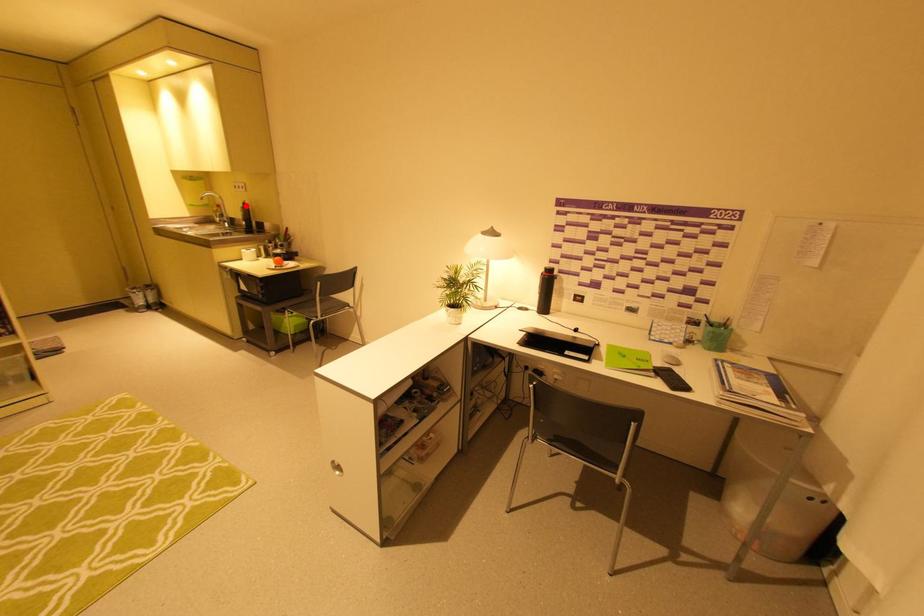
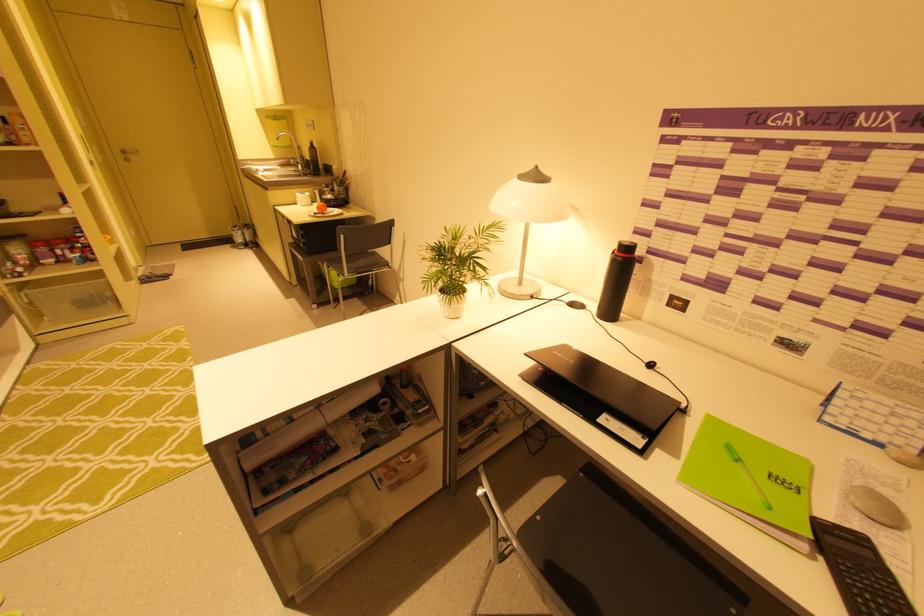
In the second image, find the point that corresponds to the highlighted location in the first image.

(313, 146)